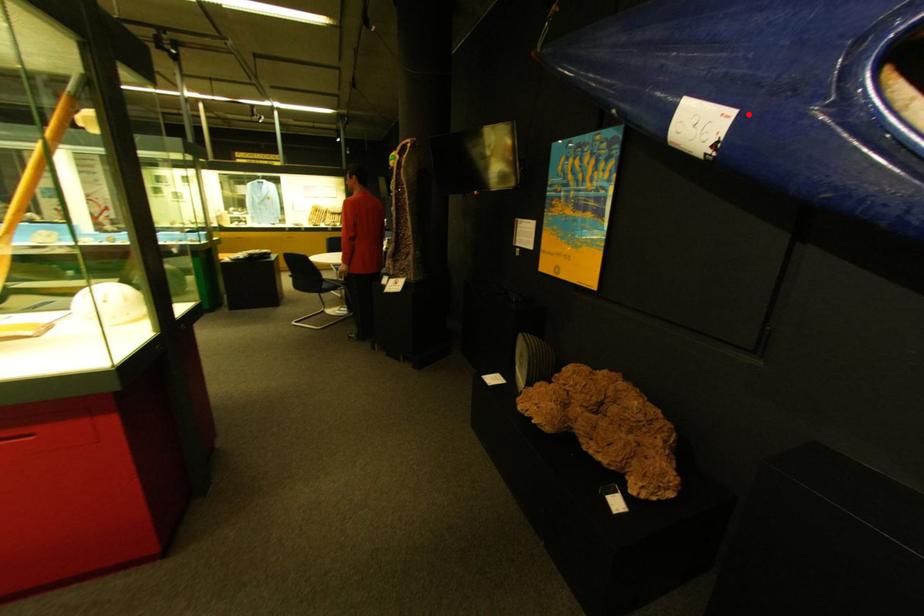
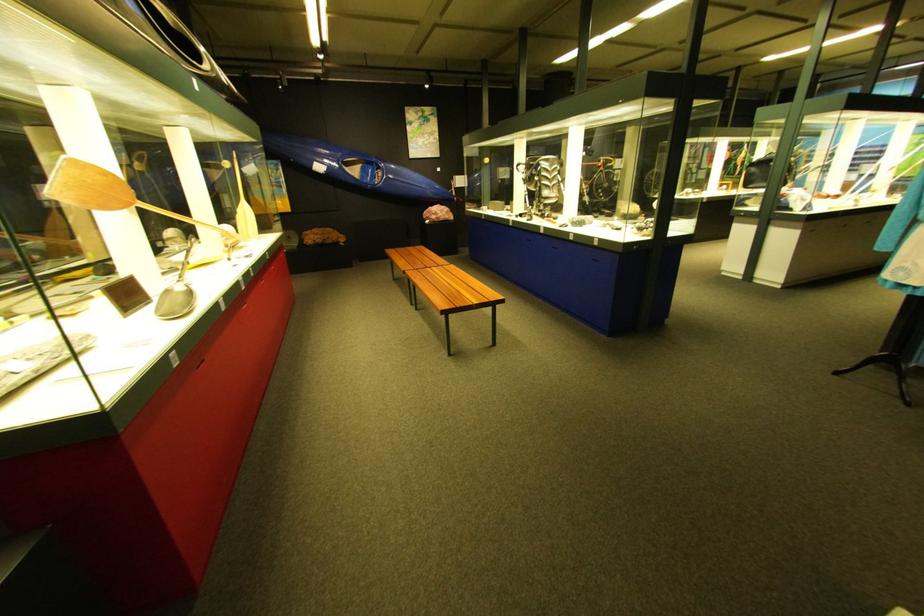
Question: I am providing you with two images of the same scene from different viewpoints. A red point is shown in image1. For the corresponding object point in image2, is it positioned nearer or farther from the camera?

Choices:
 (A) Nearer
 (B) Farther

Answer: (A)